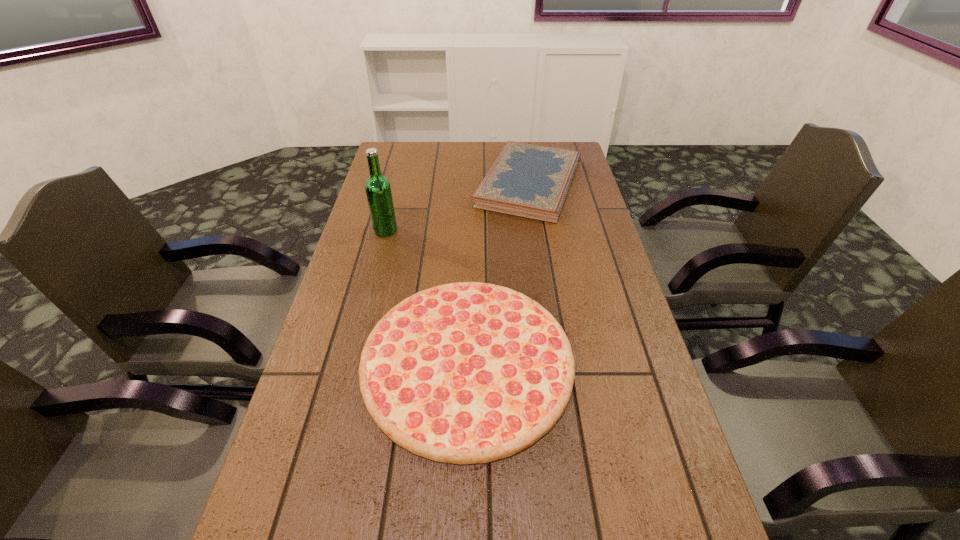
At what (x,y) coordinates should I click in order to perform the action: click on beer bottle. Please return your answer as a coordinate pair (x, y). This screenshot has width=960, height=540. Looking at the image, I should click on (378, 190).

Locate an element on the screen. paperback book is located at coordinates (527, 180).

At what (x,y) coordinates should I click in order to perform the action: click on the shortest object. Please return your answer as a coordinate pair (x, y). Looking at the image, I should click on (464, 373).

At what (x,y) coordinates should I click in order to perform the action: click on pizza. Please return your answer as a coordinate pair (x, y). Looking at the image, I should click on (464, 373).

The width and height of the screenshot is (960, 540). In order to click on vacant region located 0.350m on the front of the tallest object in this screenshot , I will do 361,327.

Identify the location of vacant space located on the front of the second shortest object. (547, 295).

Locate an element on the screen. Image resolution: width=960 pixels, height=540 pixels. vacant space located 0.370m on the back of the shortest object is located at coordinates (471, 208).

The height and width of the screenshot is (540, 960). What are the coordinates of `object located at the far edge` in the screenshot? It's located at (527, 180).

In order to click on beer bottle located in the left edge section of the desktop in this screenshot , I will do [378, 190].

Locate an element on the screen. This screenshot has width=960, height=540. pizza located in the left edge section of the desktop is located at coordinates [464, 373].